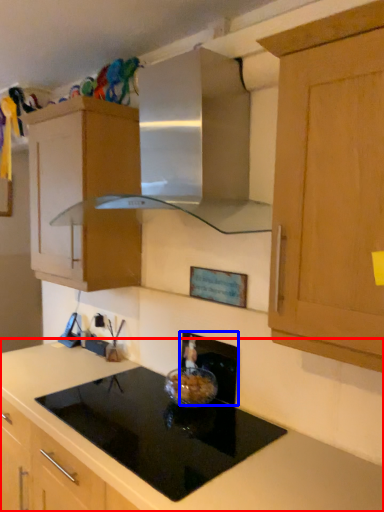
Question: Among these objects, which one is nearest to the camera, countertop (highlighted by a red box) or appliance (highlighted by a blue box)?

Choices:
 (A) countertop
 (B) appliance

Answer: (A)